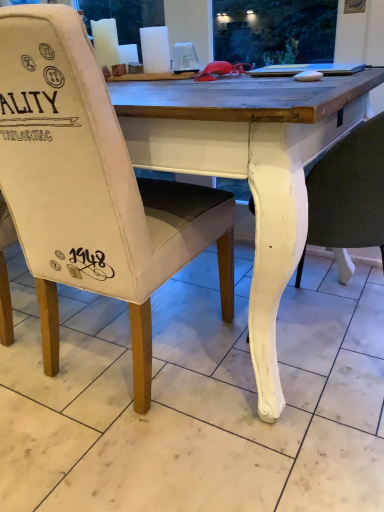
Find the location of a particular element. The height and width of the screenshot is (512, 384). free space in front of canvas chair at center, acting as the first chair starting from the left is located at coordinates (150, 459).